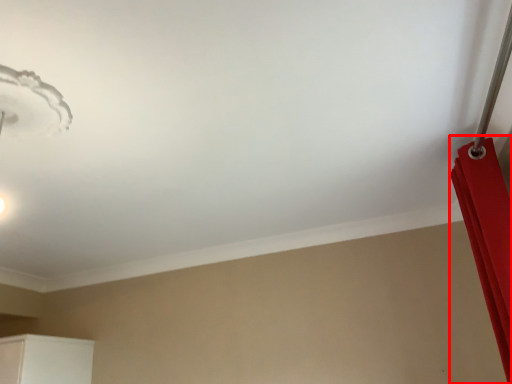
Question: Considering the relative positions of curtain (annotated by the red box) and lamp in the image provided, where is curtain (annotated by the red box) located with respect to the staircase?

Choices:
 (A) right
 (B) left

Answer: (A)